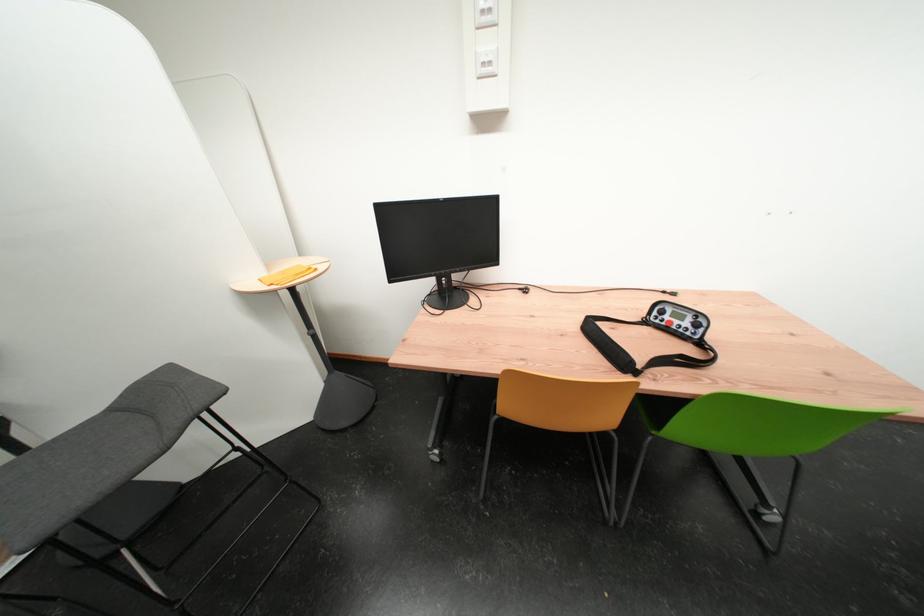
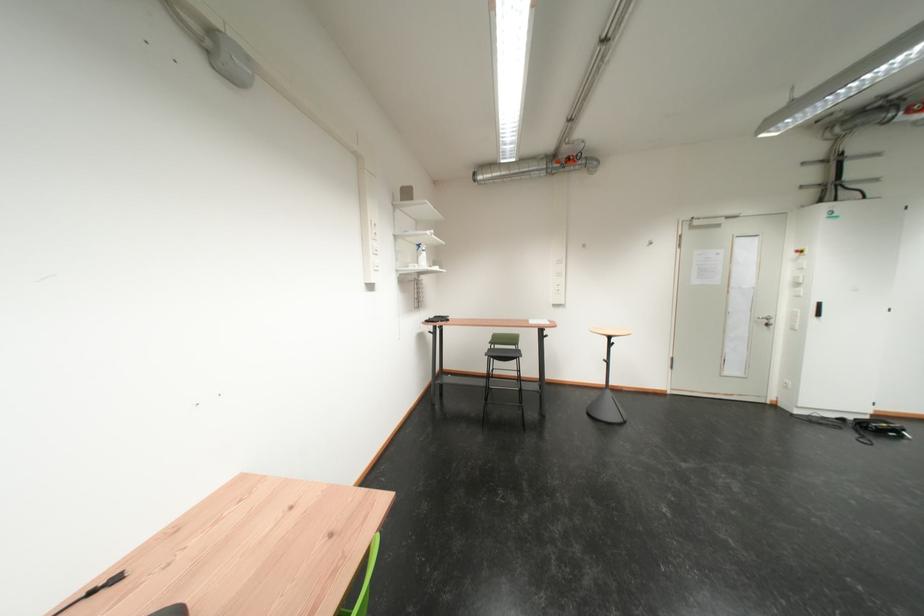
Question: The first image is from the beginning of the video and the second image is from the end. How did the camera likely rotate when shooting the video?

Choices:
 (A) Left
 (B) Right
 (C) Up
 (D) Down

Answer: (B)